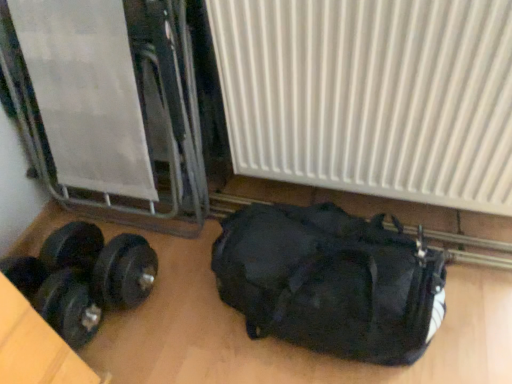
Identify the location of free space to the right of black rubber dumbbell at lower left. Image resolution: width=512 pixels, height=384 pixels. (152, 332).